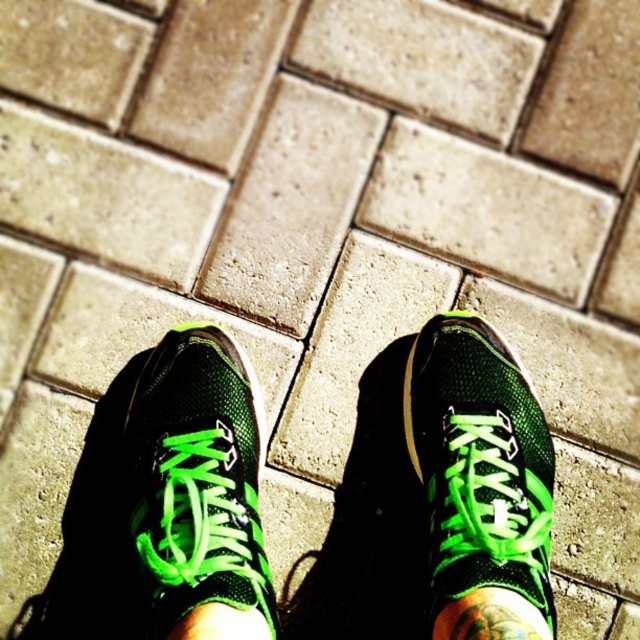
Who is positioned more to the right, green mesh shoe at center or green mesh sock at center?

Positioned to the right is green mesh shoe at center.

Where is `green mesh shoe at center`? The width and height of the screenshot is (640, 640). green mesh shoe at center is located at coordinates (481, 481).

The height and width of the screenshot is (640, 640). I want to click on green mesh shoe at center, so click(481, 481).